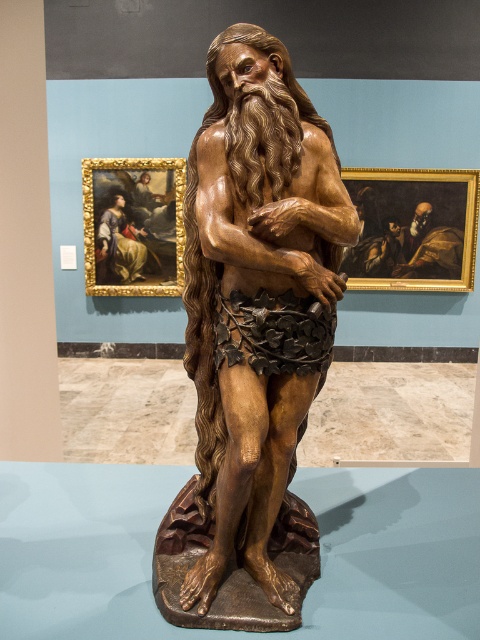
Consider the image. Is bronze statue at center above oil painting at upper left?

Incorrect, bronze statue at center is not positioned above oil painting at upper left.

Does bronze statue at center have a smaller size compared to oil painting at upper left?

No.

Where is `bronze statue at center`? bronze statue at center is located at coordinates (254, 312).

Which is in front, point (467, 186) or point (118, 243)?

Point (467, 186)

How distant is dark brown wood painting at right from oil painting at upper left?

They are 1.62 meters apart.

Is point (369, 209) farther from viewer compared to point (110, 216)?

No, (369, 209) is closer to viewer.

At what (x,y) coordinates should I click in order to perform the action: click on dark brown wood painting at right. Please return your answer as a coordinate pair (x, y). Image resolution: width=480 pixels, height=640 pixels. Looking at the image, I should click on (415, 228).

Is bronze statue at center smaller than dark brown wood painting at right?

No, bronze statue at center is not smaller than dark brown wood painting at right.

Is bronze statue at center taller than dark brown wood painting at right?

Yes.

Locate an element on the screen. The height and width of the screenshot is (640, 480). bronze statue at center is located at coordinates (254, 312).

Where is `bronze statue at center`? bronze statue at center is located at coordinates (254, 312).